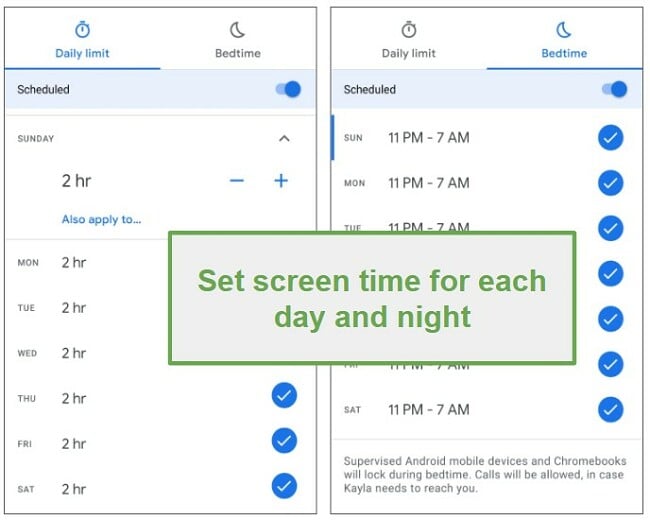
The image size is (650, 520). What are the coordinates of `alarm` in the screenshot? It's located at (406, 27).